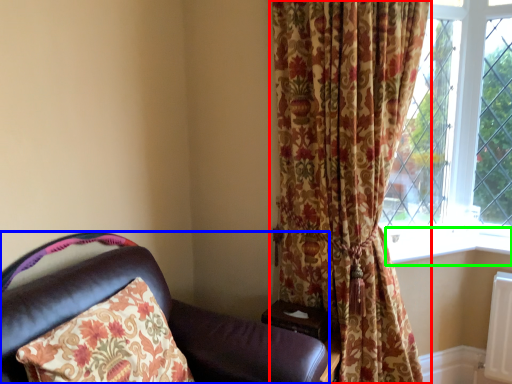
Question: Which is nearer to the curtain (highlighted by a red box)? chair (highlighted by a blue box) or window sill (highlighted by a green box).

Choices:
 (A) chair
 (B) window sill

Answer: (B)